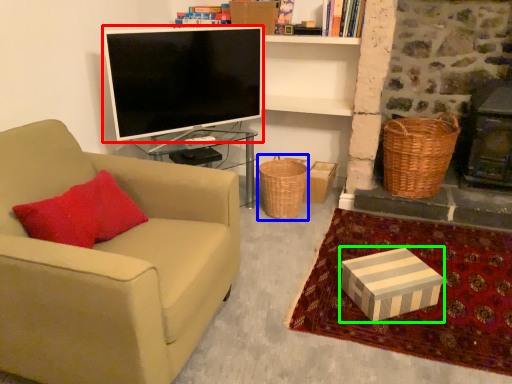
Question: Which object is the closest to the television (highlighted by a red box)? Choose among these: basket (highlighted by a blue box) or box (highlighted by a green box).

Choices:
 (A) basket
 (B) box

Answer: (A)